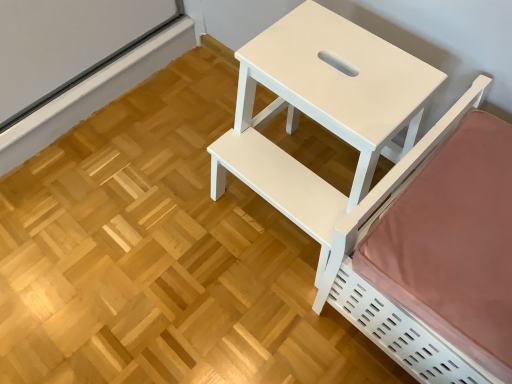
The width and height of the screenshot is (512, 384). What do you see at coordinates (337, 84) in the screenshot?
I see `white matte table at center` at bounding box center [337, 84].

At what (x,y) coordinates should I click in order to perform the action: click on white matte table at center. Please return your answer as a coordinate pair (x, y). The image size is (512, 384). Looking at the image, I should click on (337, 84).

You are a GUI agent. You are given a task and a screenshot of the screen. Output one action in this format:
    pyautogui.click(x=<x>, y=<y>)
    Task: Click on the white matte bed at right
    The image size is (512, 384).
    Given the screenshot: What is the action you would take?
    pyautogui.click(x=382, y=295)

Describe the element at coordinates (382, 295) in the screenshot. I see `white matte bed at right` at that location.

Identify the location of white matte table at center. (337, 84).

Visually, is white matte table at center positioned to the left or to the right of white matte bed at right?

white matte table at center is to the left of white matte bed at right.

Considering the positions of objects white matte table at center and white matte bed at right in the image provided, who is in front, white matte table at center or white matte bed at right?

white matte bed at right is in front.

Considering the positions of points (355, 180) and (323, 278), is point (355, 180) closer to camera compared to point (323, 278)?

Yes, point (355, 180) is closer to viewer.

From the image's perspective, is white matte table at center located beneath white matte bed at right?

No, from the image's perspective, white matte table at center is not below white matte bed at right.

Consider the image. From a real-world perspective, which is physically above, white matte table at center or white matte bed at right?

From a 3D spatial view, white matte table at center is above.

Can you confirm if white matte table at center is wider than white matte bed at right?

No.

Is white matte table at center taller or shorter than white matte bed at right?

Clearly, white matte table at center is taller compared to white matte bed at right.

Considering the sizes of objects white matte table at center and white matte bed at right in the image provided, who is bigger, white matte table at center or white matte bed at right?

white matte bed at right is bigger.

Is white matte bed at right a part of white matte table at center?

No.

Does white matte table at center touch white matte bed at right?

There is a gap between white matte table at center and white matte bed at right.

Could you tell me if white matte table at center is turned towards white matte bed at right?

No.

How different are the orientations of white matte table at center and white matte bed at right in degrees?

2.29 degrees.

You are a GUI agent. You are given a task and a screenshot of the screen. Output one action in this format:
    pyautogui.click(x=<x>, y=<y>)
    Task: Click on the furniture to the right of white matte table at center
    
    Given the screenshot: What is the action you would take?
    pyautogui.click(x=382, y=295)

Between white matte bed at right and white matte table at center, which one appears on the left side from the viewer's perspective?

From the viewer's perspective, white matte table at center appears more on the left side.

Who is more distant, white matte bed at right or white matte table at center?

white matte table at center is behind.

Between point (442, 343) and point (410, 67), which one is positioned behind?

The point (410, 67) is more distant.

From the image's perspective, who appears lower, white matte bed at right or white matte table at center?

white matte bed at right.

From a real-world perspective, between white matte bed at right and white matte table at center, who is vertically higher?

white matte table at center, from a real-world perspective.

Is white matte bed at right wider than white matte table at center?

Correct, the width of white matte bed at right exceeds that of white matte table at center.

Who is taller, white matte bed at right or white matte table at center?

With more height is white matte table at center.

Is white matte bed at right bigger than white matte table at center?

Yes, white matte bed at right is bigger than white matte table at center.

Is white matte bed at right outside of white matte table at center?

That's correct, white matte bed at right is outside of white matte table at center.

Is white matte bed at right next to white matte table at center?

No, white matte bed at right is not beside white matte table at center.

Is white matte bed at right oriented towards white matte table at center?

No, white matte bed at right is not oriented towards white matte table at center.

Can you tell me how much white matte bed at right and white matte table at center differ in facing direction?

There is a 2.29-degree angle between the facing directions of white matte bed at right and white matte table at center.

How distant is white matte bed at right from white matte table at center?

white matte bed at right and white matte table at center are 9.03 inches apart.

The height and width of the screenshot is (384, 512). I want to click on table above the white matte bed at right (from a real-world perspective), so click(337, 84).

Image resolution: width=512 pixels, height=384 pixels. Find the location of `table above the white matte bed at right (from the image's perspective)`. table above the white matte bed at right (from the image's perspective) is located at coordinates (337, 84).

The width and height of the screenshot is (512, 384). In order to click on furniture in front of the white matte table at center in this screenshot , I will do `click(382, 295)`.